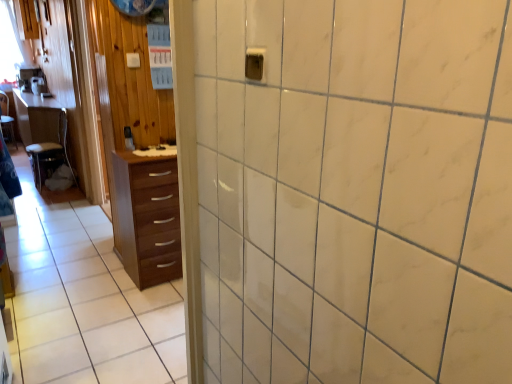
Question: From a real-world perspective, is brown wood chest of drawers at left located beneath wooden table at left?

Choices:
 (A) yes
 (B) no

Answer: (A)

Question: Is brown wood chest of drawers at left to the right of wooden table at left from the viewer's perspective?

Choices:
 (A) yes
 (B) no

Answer: (A)

Question: Does brown wood chest of drawers at left have a larger size compared to wooden table at left?

Choices:
 (A) yes
 (B) no

Answer: (B)

Question: From the image's perspective, is brown wood chest of drawers at left under wooden table at left?

Choices:
 (A) yes
 (B) no

Answer: (A)

Question: Would you say brown wood chest of drawers at left is a long distance from wooden table at left?

Choices:
 (A) no
 (B) yes

Answer: (B)

Question: From a real-world perspective, is wooden chair at left positioned above or below brown wood chest of drawers at left?

Choices:
 (A) above
 (B) below

Answer: (B)

Question: Choose the correct answer: Is wooden chair at left inside brown wood chest of drawers at left or outside it?

Choices:
 (A) inside
 (B) outside

Answer: (B)

Question: From the image's perspective, is wooden chair at left above or below brown wood chest of drawers at left?

Choices:
 (A) above
 (B) below

Answer: (A)

Question: Visually, is wooden chair at left positioned to the left or to the right of brown wood chest of drawers at left?

Choices:
 (A) right
 (B) left

Answer: (B)

Question: From a real-world perspective, is wooden table at left positioned above or below wooden chair at left?

Choices:
 (A) above
 (B) below

Answer: (A)

Question: Would you say wooden table at left is to the left or to the right of wooden chair at left in the picture?

Choices:
 (A) left
 (B) right

Answer: (A)

Question: In terms of size, does wooden table at left appear bigger or smaller than wooden chair at left?

Choices:
 (A) small
 (B) big

Answer: (B)

Question: Is wooden table at left spatially inside wooden chair at left, or outside of it?

Choices:
 (A) inside
 (B) outside

Answer: (B)

Question: Looking at the image, does wooden chair at left seem bigger or smaller compared to wooden table at left?

Choices:
 (A) small
 (B) big

Answer: (A)

Question: From a real-world perspective, is wooden chair at left physically located above or below wooden table at left?

Choices:
 (A) above
 (B) below

Answer: (B)